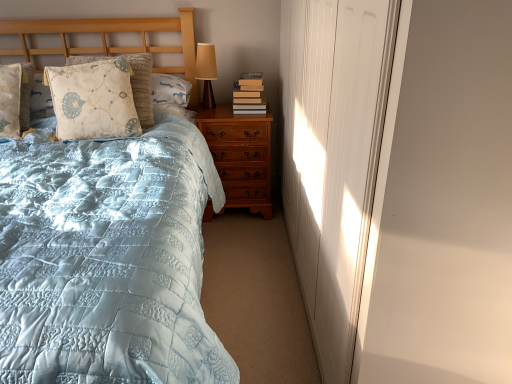
Question: In the image, is matte brown table lamp at upper center positioned in front of or behind light blue quilted bed at left?

Choices:
 (A) behind
 (B) front

Answer: (A)

Question: Considering the positions of matte brown table lamp at upper center and light blue quilted bed at left in the image, is matte brown table lamp at upper center taller or shorter than light blue quilted bed at left?

Choices:
 (A) tall
 (B) short

Answer: (B)

Question: Based on their relative distances, which object is nearer to the light brown wood nightstand at center?

Choices:
 (A) fluffy beige pillow at left, the second pillow viewed from the right
 (B) white matte door at right
 (C) light blue quilted bed at left
 (D) hardcover books at right
 (E) floral-patterned fabric pillow at upper left, the second pillow from the left

Answer: (D)

Question: Estimate the real-world distances between objects in this image. Which object is closer to the white matte door at right?

Choices:
 (A) light blue quilted bed at left
 (B) floral-patterned fabric pillow at upper left, which is the first pillow from right to left
 (C) matte brown table lamp at upper center
 (D) fluffy beige pillow at left, the second pillow viewed from the right
 (E) hardcover books at right

Answer: (A)